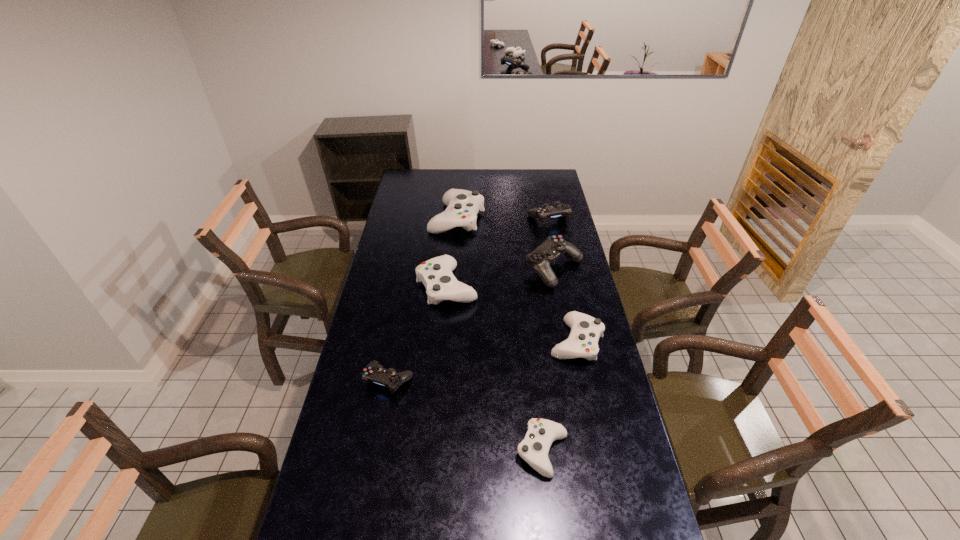
The image size is (960, 540). I want to click on the biggest white control, so click(462, 205).

Find the location of a particular element. The image size is (960, 540). the biggest black control is located at coordinates (543, 256).

Identify the location of the second farthest white control. The width and height of the screenshot is (960, 540). (436, 274).

Identify the location of the second biggest black control. (558, 210).

You are a GUI agent. You are given a task and a screenshot of the screen. Output one action in this format:
    pyautogui.click(x=<x>, y=<y>)
    Task: Click on the third biggest white control
    The width and height of the screenshot is (960, 540).
    Given the screenshot: What is the action you would take?
    pyautogui.click(x=582, y=342)

Identify the location of the nearest black control. The height and width of the screenshot is (540, 960). (374, 372).

Where is `the smallest black control`? the smallest black control is located at coordinates (374, 372).

Locate an element on the screen. This screenshot has width=960, height=540. the smallest white control is located at coordinates (534, 449).

I want to click on the nearest object, so click(x=534, y=449).

Identify the location of vacant region located on the front of the biggest white control. (452, 287).